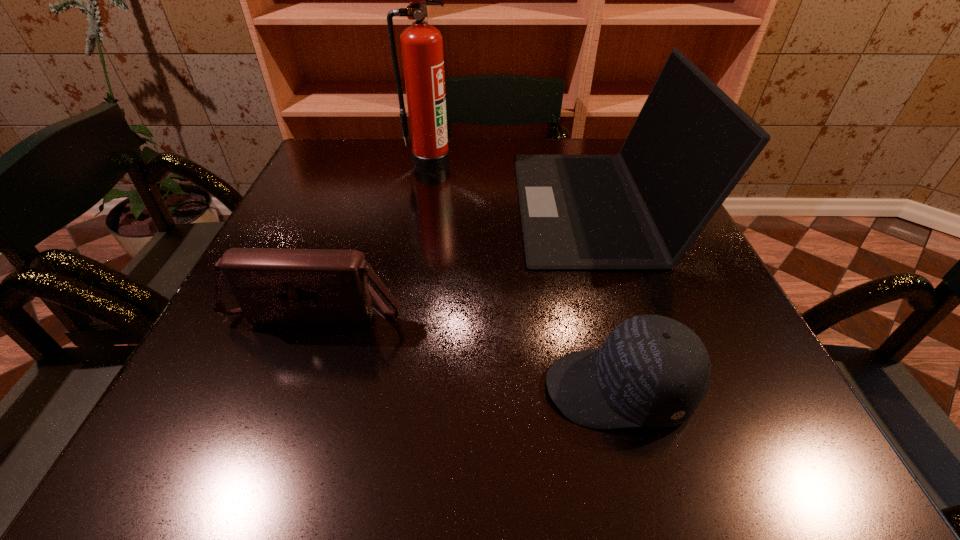
Image resolution: width=960 pixels, height=540 pixels. What are the coordinates of `object that is at the far right corner` in the screenshot? It's located at pyautogui.click(x=643, y=208).

Find the location of a particular element. This screenshot has height=540, width=960. object located in the near right corner section of the desktop is located at coordinates (652, 371).

This screenshot has height=540, width=960. Find the location of `vacant space at the far edge`. vacant space at the far edge is located at coordinates (390, 181).

Find the location of `vacant space at the left edge`. vacant space at the left edge is located at coordinates (192, 381).

Locate an element on the screen. This screenshot has width=960, height=540. vacant space at the far left corner is located at coordinates (331, 174).

In the image, there is a desktop. Identify the location of vacant space at the near right corner. (798, 427).

The width and height of the screenshot is (960, 540). What are the coordinates of `vacant space that's between the tallest object and the laptop` in the screenshot? It's located at (514, 184).

Locate an element on the screen. empty space between the shoulder bag and the shortest object is located at coordinates (468, 349).

Image resolution: width=960 pixels, height=540 pixels. Find the location of `free space between the third shortest object and the nearest object`. free space between the third shortest object and the nearest object is located at coordinates (608, 296).

You are a GUI agent. You are given a task and a screenshot of the screen. Output one action in this format:
    pyautogui.click(x=<x>, y=<y>)
    Task: Click on the vacant space in between the third shortest object and the shortest object
    This screenshot has width=960, height=540.
    Given the screenshot: What is the action you would take?
    [608, 296]